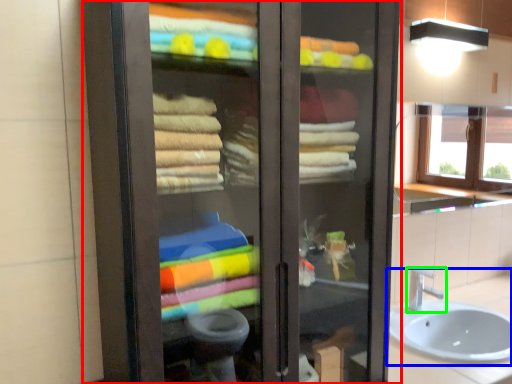
Question: Which object is positioned closest to bathroom cabinet (highlighted by a red box)? Select from sink (highlighted by a blue box) and tap (highlighted by a green box).

Choices:
 (A) sink
 (B) tap

Answer: (A)